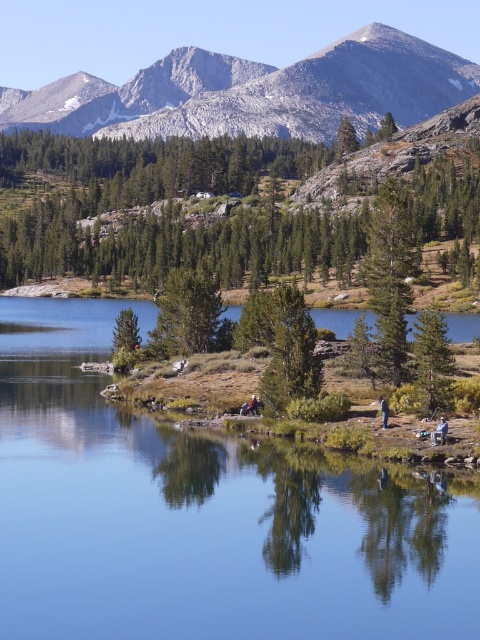
Question: Which of the following is the farthest from the observer?

Choices:
 (A) (236, 88)
 (B) (213, 292)
 (C) (146, 614)
 (D) (384, 413)

Answer: (A)

Question: Which point is farther to the camera?

Choices:
 (A) dark blue jeans at lower center
 (B) gray rocky mountain at upper center
 (C) smooth reflective water at center
 (D) green matte tree at center-right

Answer: (B)

Question: Which object is positioned closest to the smooth reflective water at center?

Choices:
 (A) blue denim jacket at lower right
 (B) green matte tree at upper center

Answer: (A)

Question: Is smooth reflective water at center further to camera compared to gray rocky mountain at upper center?

Choices:
 (A) yes
 (B) no

Answer: (B)

Question: Considering the relative positions of green matte tree at upper center and gray rocky mountain at upper center in the image provided, where is green matte tree at upper center located with respect to gray rocky mountain at upper center?

Choices:
 (A) below
 (B) above

Answer: (A)

Question: Does green matte tree at center-right come in front of green matte tree at center?

Choices:
 (A) yes
 (B) no

Answer: (A)